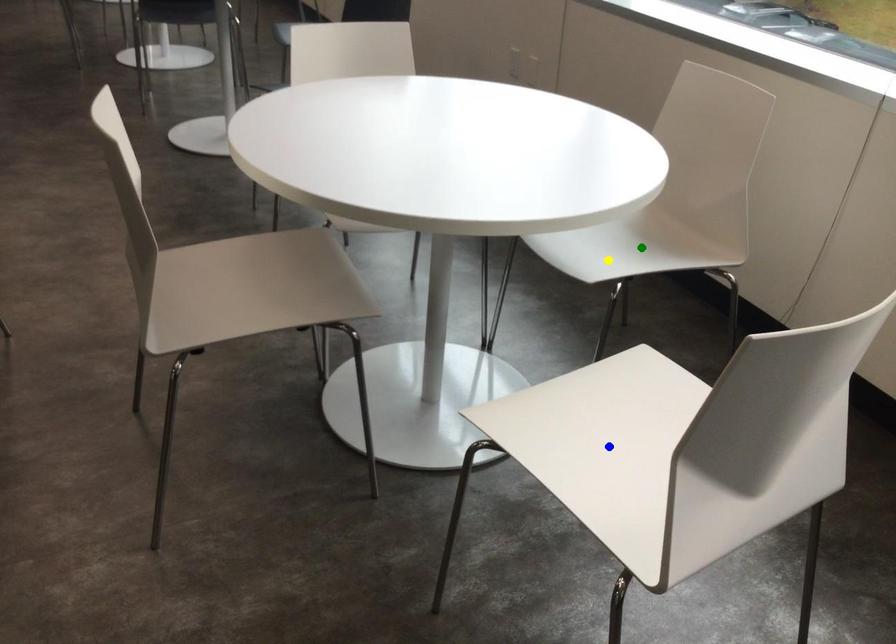
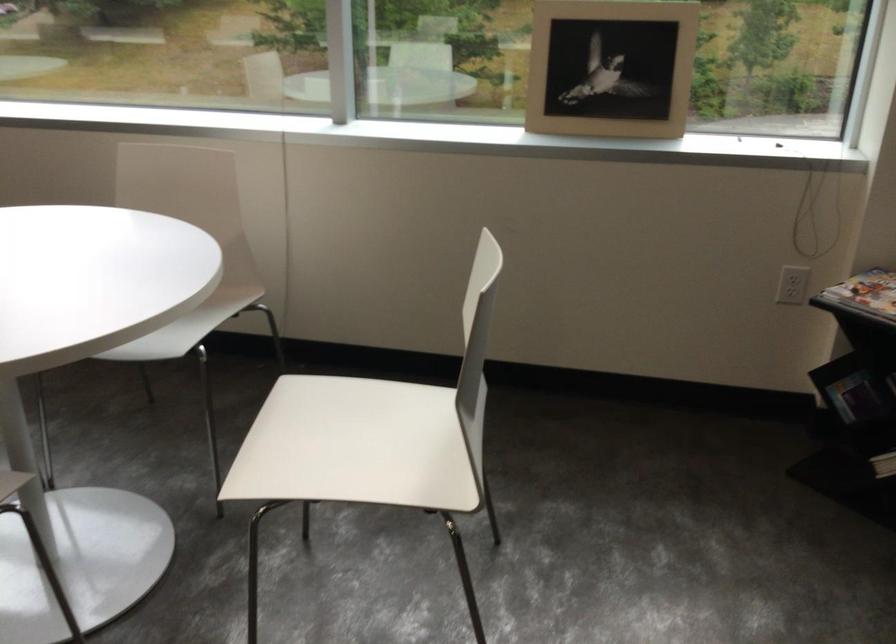
I am providing you with two images of the same scene from different viewpoints. Three points are marked in image1. Which point corresponds to a part or object that is occluded in image2?In image1, three points are marked. Which of them correspond to a part or object that is occluded in image2?Among the three points shown in image1, which one corresponds to a part or object that is no longer visible due to occlusion in image2?

green point